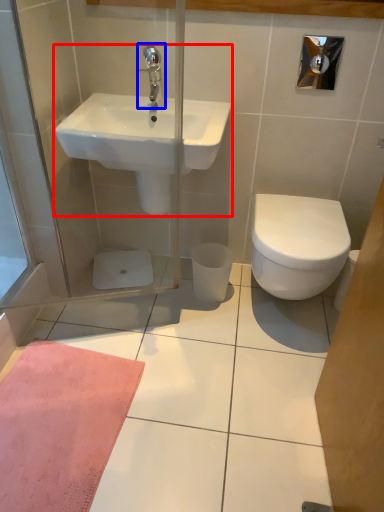
Question: Among these objects, which one is nearest to the camera, sink (highlighted by a red box) or tap (highlighted by a blue box)?

Choices:
 (A) sink
 (B) tap

Answer: (A)